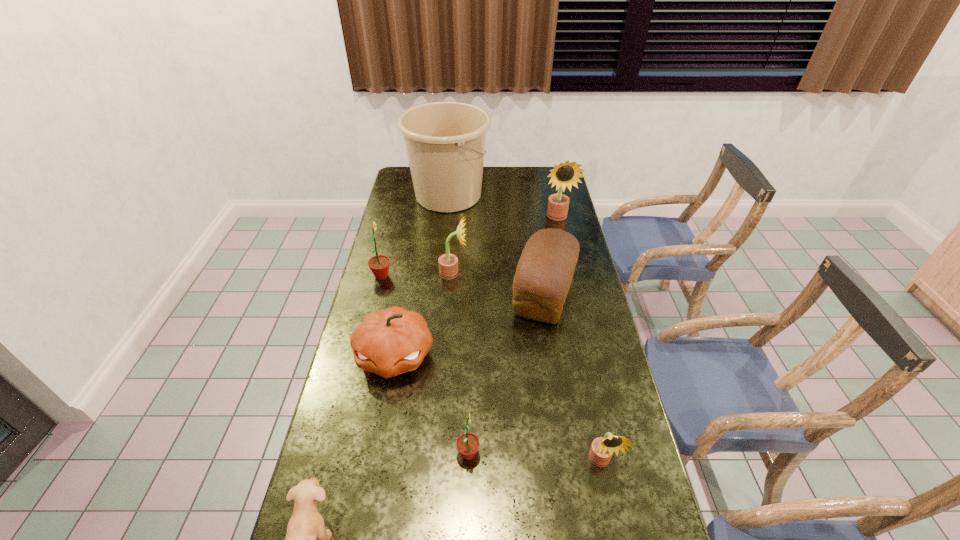
Identify the location of vacant space positioned on the face of the nearest yellow sunflower. The height and width of the screenshot is (540, 960). (610, 507).

At what (x,y) coordinates should I click in order to perform the action: click on object present at the far edge. Please return your answer as a coordinate pair (x, y). The width and height of the screenshot is (960, 540). Looking at the image, I should click on (445, 141).

I want to click on bucket located at the left edge, so click(445, 141).

The image size is (960, 540). I want to click on sunflower that is at the left edge, so click(379, 264).

Find the location of `pumpkin located in the left edge section of the desktop`. pumpkin located in the left edge section of the desktop is located at coordinates (392, 341).

Find the location of `bread that is at the right edge`. bread that is at the right edge is located at coordinates (544, 273).

Identify the location of object at the far left corner. Image resolution: width=960 pixels, height=540 pixels. (445, 141).

I want to click on vacant space at the far edge of the desktop, so click(x=498, y=184).

Identify the location of free location at the left edge of the desktop. (396, 202).

The image size is (960, 540). What are the coordinates of `vacant space at the right edge of the desktop` in the screenshot? It's located at (558, 324).